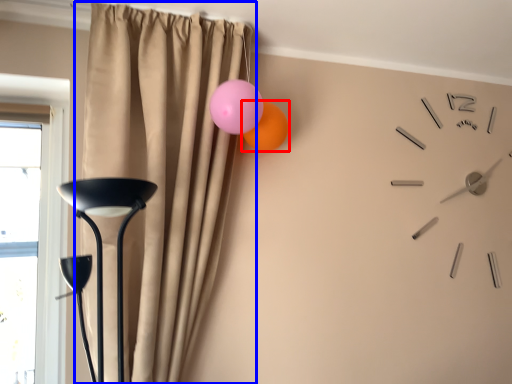
Question: Which object appears closest to the camera in this image, balloon (highlighted by a red box) or curtain (highlighted by a blue box)?

Choices:
 (A) balloon
 (B) curtain

Answer: (B)